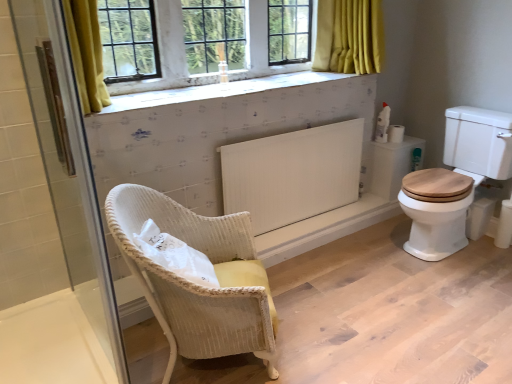
Question: Does white textured tile at upper center turn towards woven yellow chair at center?

Choices:
 (A) no
 (B) yes

Answer: (A)

Question: Is the position of white textured tile at upper center more distant than that of woven yellow chair at center?

Choices:
 (A) no
 (B) yes

Answer: (B)

Question: Is white textured tile at upper center to the left of woven yellow chair at center from the viewer's perspective?

Choices:
 (A) no
 (B) yes

Answer: (A)

Question: Is white textured tile at upper center far from woven yellow chair at center?

Choices:
 (A) yes
 (B) no

Answer: (B)

Question: Considering the relative positions of white textured tile at upper center and woven yellow chair at center in the image provided, is white textured tile at upper center in front of woven yellow chair at center?

Choices:
 (A) yes
 (B) no

Answer: (B)

Question: Considering the relative sizes of white textured tile at upper center and woven yellow chair at center in the image provided, is white textured tile at upper center taller than woven yellow chair at center?

Choices:
 (A) no
 (B) yes

Answer: (A)

Question: Is white textured tile at upper center directly adjacent to white matte toilet paper at right?

Choices:
 (A) no
 (B) yes

Answer: (A)

Question: Is white textured tile at upper center to the left of white matte toilet paper at right from the viewer's perspective?

Choices:
 (A) yes
 (B) no

Answer: (A)

Question: Considering the relative sizes of white textured tile at upper center and white matte toilet paper at right in the image provided, is white textured tile at upper center smaller than white matte toilet paper at right?

Choices:
 (A) no
 (B) yes

Answer: (A)

Question: Does white textured tile at upper center turn towards white matte toilet paper at right?

Choices:
 (A) yes
 (B) no

Answer: (B)

Question: Is white textured tile at upper center not close to white matte toilet paper at right?

Choices:
 (A) no
 (B) yes

Answer: (B)

Question: Considering the relative sizes of white textured tile at upper center and white matte toilet paper at right in the image provided, is white textured tile at upper center shorter than white matte toilet paper at right?

Choices:
 (A) no
 (B) yes

Answer: (B)

Question: Can you confirm if white matte toilet paper at right is thinner than transparent glass shower door at left?

Choices:
 (A) no
 (B) yes

Answer: (A)